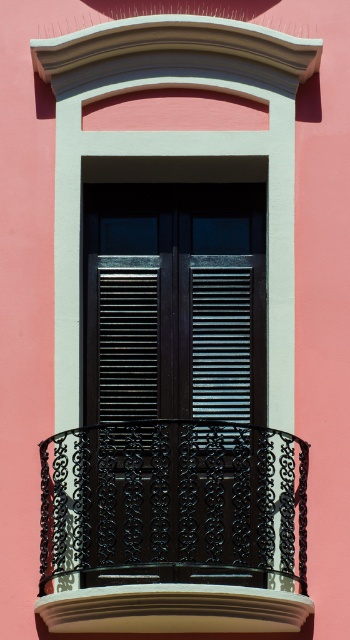
Is black wrought iron balcony at center to the left of metallic dark gray shutter at center from the viewer's perspective?

Yes, black wrought iron balcony at center is to the left of metallic dark gray shutter at center.

Can you confirm if black wrought iron balcony at center is bigger than metallic dark gray shutter at center?

Yes.

Who is more distant from viewer, (281, 490) or (235, 417)?

Point (235, 417)

In order to click on black wrought iron balcony at center in this screenshot , I will do `click(172, 529)`.

Is black matte shutters at center closer to the viewer compared to metallic dark gray shutter at center?

Yes, black matte shutters at center is in front of metallic dark gray shutter at center.

Is point (101, 376) in front of point (231, 310)?

That is True.

Find the location of a particular element. The image size is (350, 640). black matte shutters at center is located at coordinates coord(128,349).

Locate an element on the screen. This screenshot has height=640, width=350. black wrought iron balcony at center is located at coordinates (172, 529).

Does point (65, 577) lie in front of point (121, 410)?

Yes, it is in front of point (121, 410).

The width and height of the screenshot is (350, 640). I want to click on black wrought iron balcony at center, so click(172, 529).